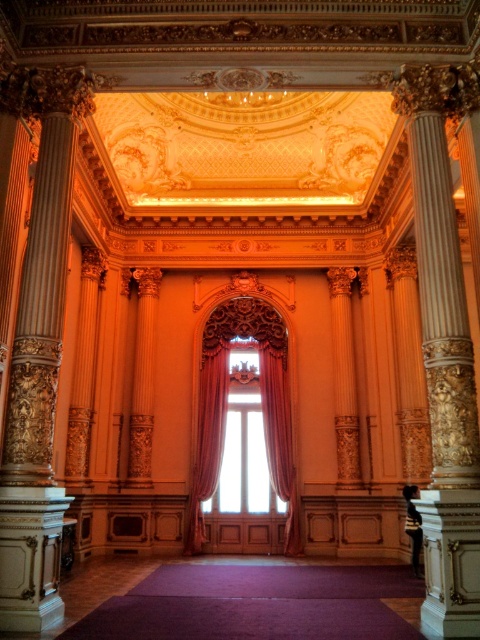
Question: Which point is farther to the camera?

Choices:
 (A) pyautogui.click(x=279, y=468)
 (B) pyautogui.click(x=210, y=406)

Answer: (B)

Question: Can you confirm if velvet pink curtain at center is positioned above velvet curtain at center?

Choices:
 (A) no
 (B) yes

Answer: (B)

Question: Is velvet pink curtain at center to the right of velvet curtain at center from the viewer's perspective?

Choices:
 (A) yes
 (B) no

Answer: (B)

Question: From the image, what is the correct spatial relationship of velvet pink curtain at center in relation to velvet curtain at center?

Choices:
 (A) right
 (B) left

Answer: (B)